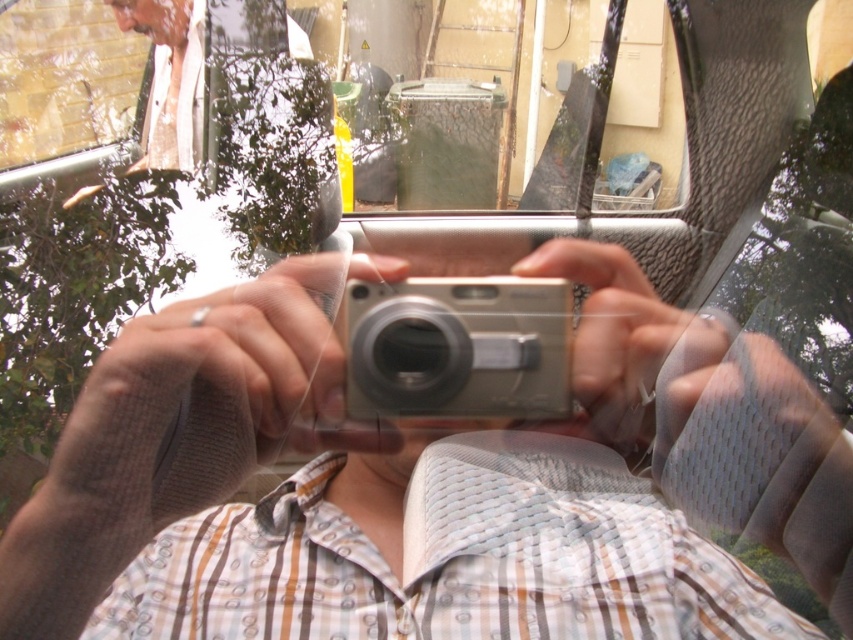
Question: Is white textured shirt at center above silver metallic camera at center?

Choices:
 (A) no
 (B) yes

Answer: (A)

Question: Is white textured shirt at center wider than silver metallic camera at center?

Choices:
 (A) yes
 (B) no

Answer: (A)

Question: Which object appears closest to the camera in this image?

Choices:
 (A) silver metallic camera at center
 (B) white textured shirt at center

Answer: (B)

Question: Which of the following is the farthest from the observer?

Choices:
 (A) white textured shirt at center
 (B) silver metallic camera at center

Answer: (B)

Question: Does white textured shirt at center have a larger size compared to silver metallic camera at center?

Choices:
 (A) yes
 (B) no

Answer: (A)